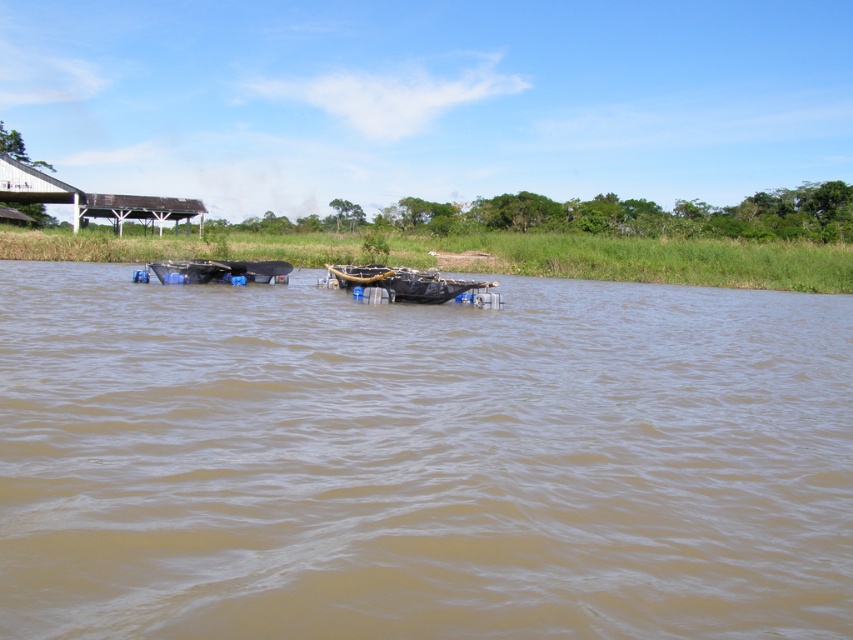
Question: Which object is positioned farthest from the brown muddy water at center?

Choices:
 (A) wooden boat at center
 (B) dark brown wooden boat at center

Answer: (B)

Question: Does wooden boat at center appear over dark brown wooden boat at center?

Choices:
 (A) yes
 (B) no

Answer: (A)

Question: Which point appears farthest from the camera in this image?

Choices:
 (A) (410, 310)
 (B) (169, 269)

Answer: (B)

Question: Is brown muddy water at center bigger than wooden boat at center?

Choices:
 (A) no
 (B) yes

Answer: (B)

Question: Which of the following is the closest to the observer?

Choices:
 (A) dark brown wooden boat at center
 (B) brown muddy water at center
 (C) wooden boat at center

Answer: (B)

Question: Does wooden boat at center have a lesser width compared to dark brown wooden boat at center?

Choices:
 (A) no
 (B) yes

Answer: (A)